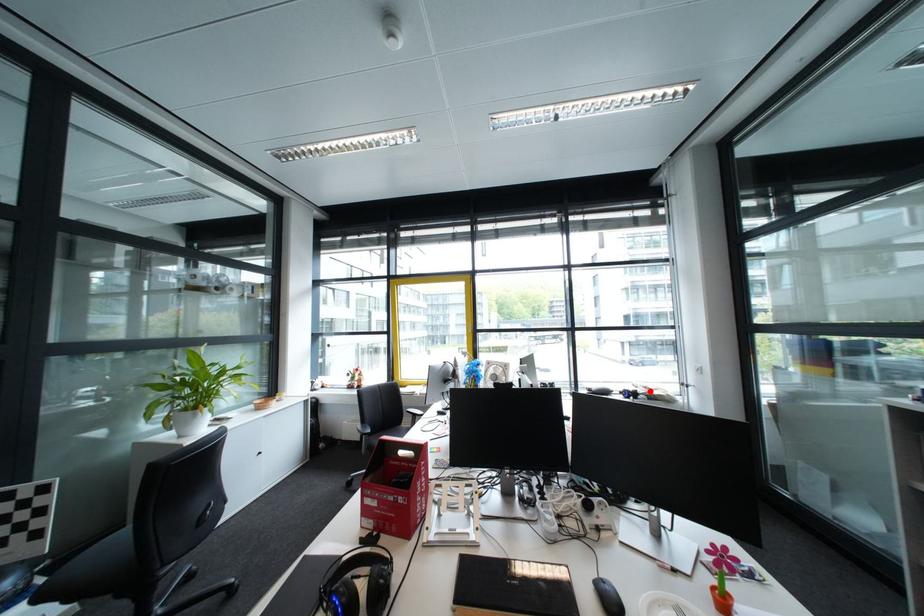
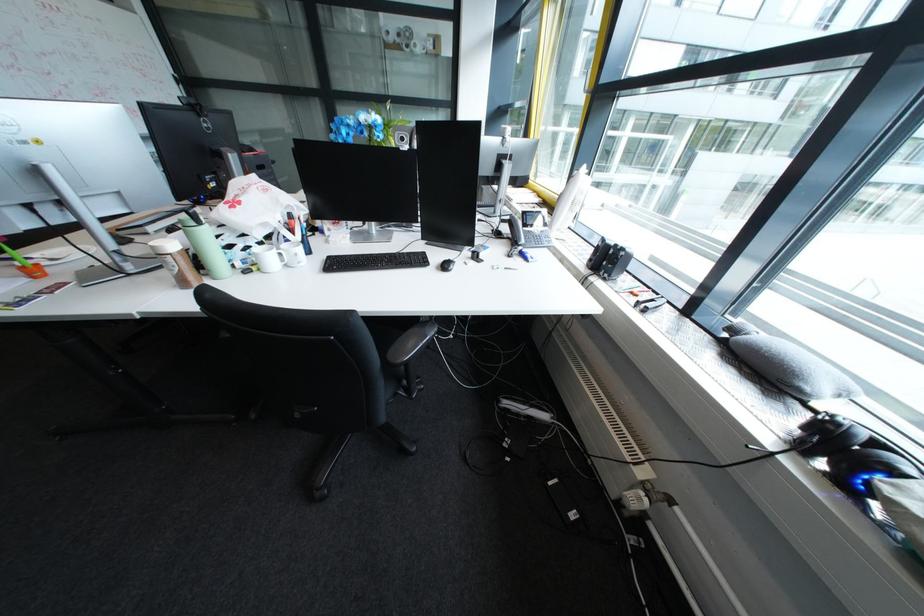
The point at the highlighted location is marked in the first image. Where is the corresponding point in the second image?

(909, 474)